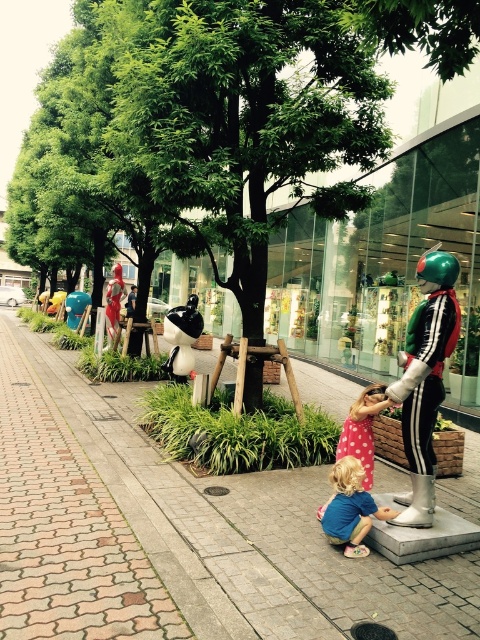
You are standing at the entrance of the pedestrian area and see the shiny metallic robot at center right and the blue cotton shirt at lower center. Which object is positioned to the right side?

The shiny metallic robot at center right is positioned to the right of the blue cotton shirt at lower center.

You are a delivery person with a cart that is 1.5 meters wide. You need to move from the statue to the brick pavement at center. Is there enough space for your cart to pass between them?

The distance between the statue and the brick pavement at center is 1.69 meters, so yes, the cart can pass since it is 1.5 meters wide and the space is wider than the cart.